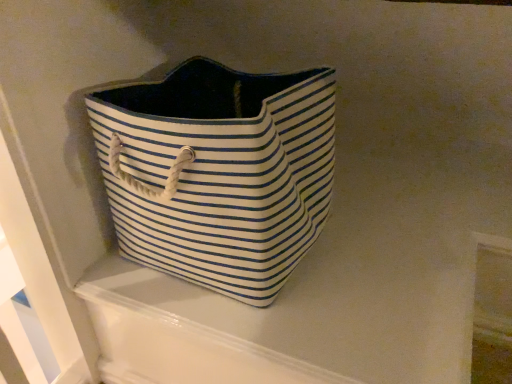
Find the location of `white striped fabric bag at center`. white striped fabric bag at center is located at coordinates (219, 172).

The height and width of the screenshot is (384, 512). Describe the element at coordinates (219, 172) in the screenshot. I see `white striped fabric bag at center` at that location.

Measure the distance between point (x=140, y=250) and camera.

Point (x=140, y=250) is 27.80 inches away from camera.

The image size is (512, 384). I want to click on white striped fabric bag at center, so click(x=219, y=172).